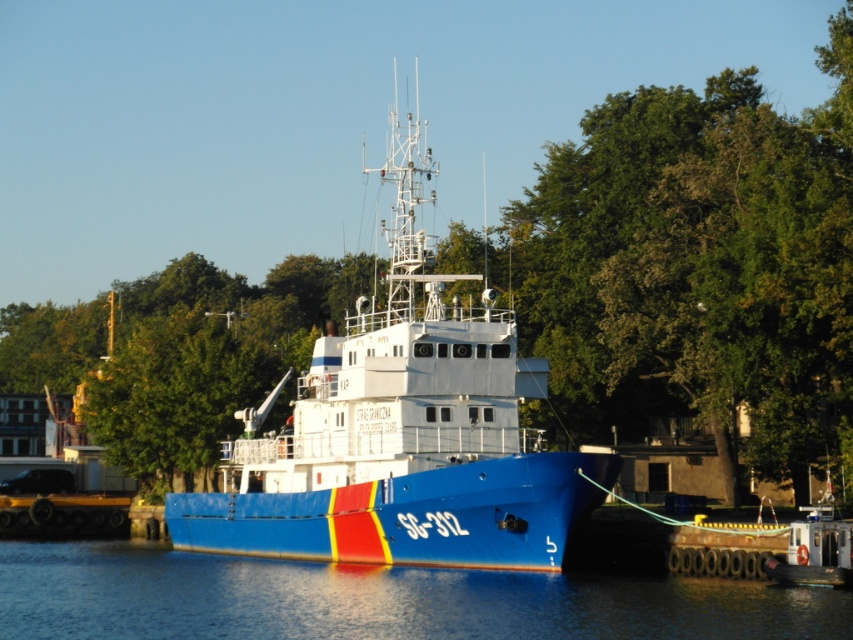
You are a photographer planning to take a photo of the blue matte boat at center and the blue glossy water at lower center. Which object should you focus on first if you want to capture both in one frame without moving the camera?

Since the blue matte boat at center is larger in size than the blue glossy water at lower center, you should focus on the blue matte boat at center first to ensure its details are sharp, as it occupies more of the frame.

Consider the image. You are a marine biologist preparing to board the blue matte boat at center from the blue glossy water at lower center. What is the minimum distance you need to swim to reach the boat?

The blue matte boat at center and blue glossy water at lower center are 13.75 meters apart from each other, so you need to swim at least 13.75 meters to reach the boat.

You are a marine biologist preparing to board the blue matte boat at center for a research trip. You notice the blue glossy water at lower center. Is the boat currently floating on the water or docked at a pier?

The blue matte boat at center is positioned over blue glossy water at lower center, which means it is floating on the water rather than being docked at a pier.